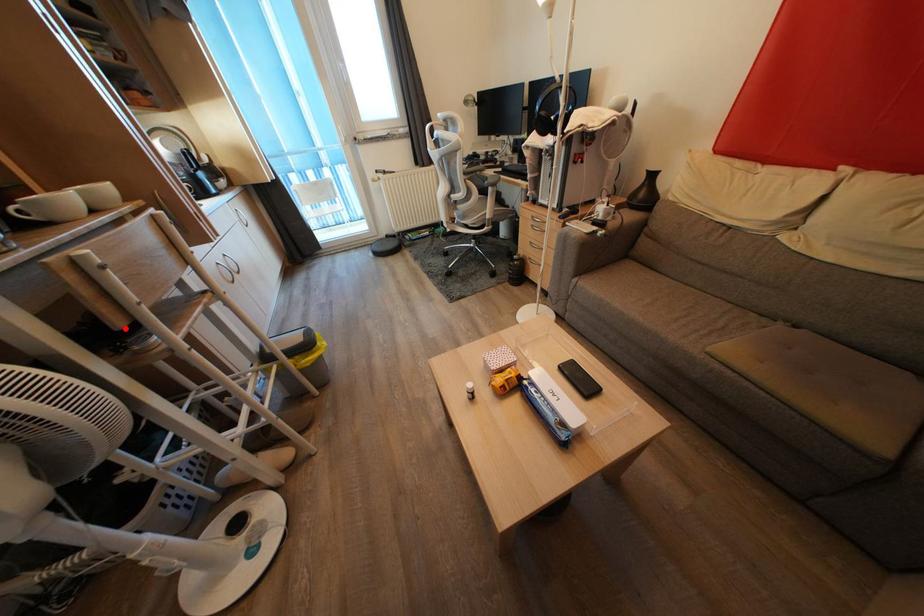
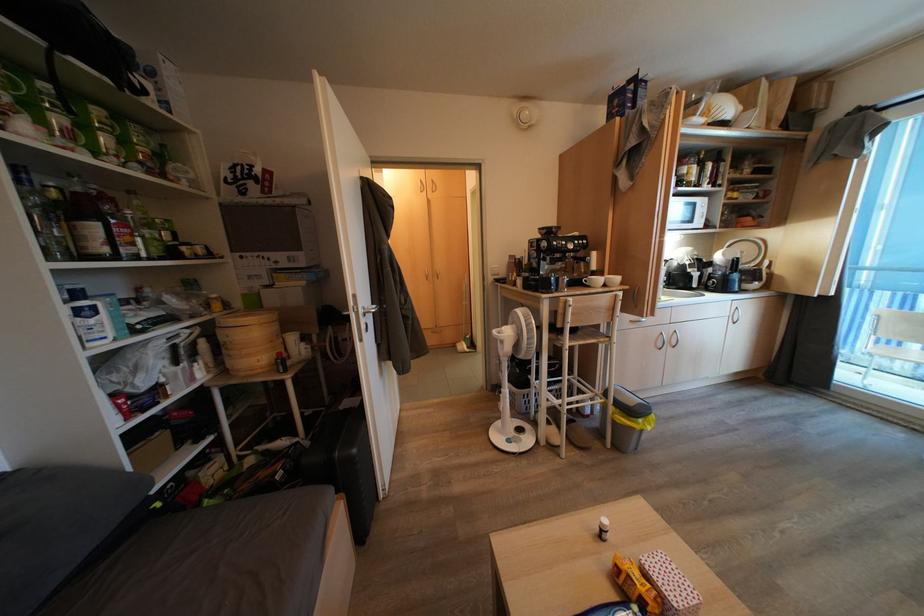
In the second image, find the point that corresponds to the highlighted location in the first image.

(564, 330)